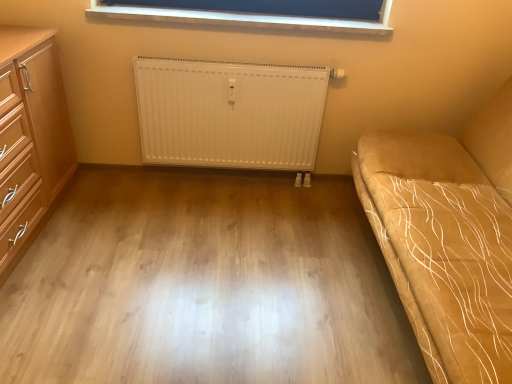
What are the coordinates of `blank space situated above blue fabric at upper center (from a real-world perspective)` in the screenshot? It's located at (247, 14).